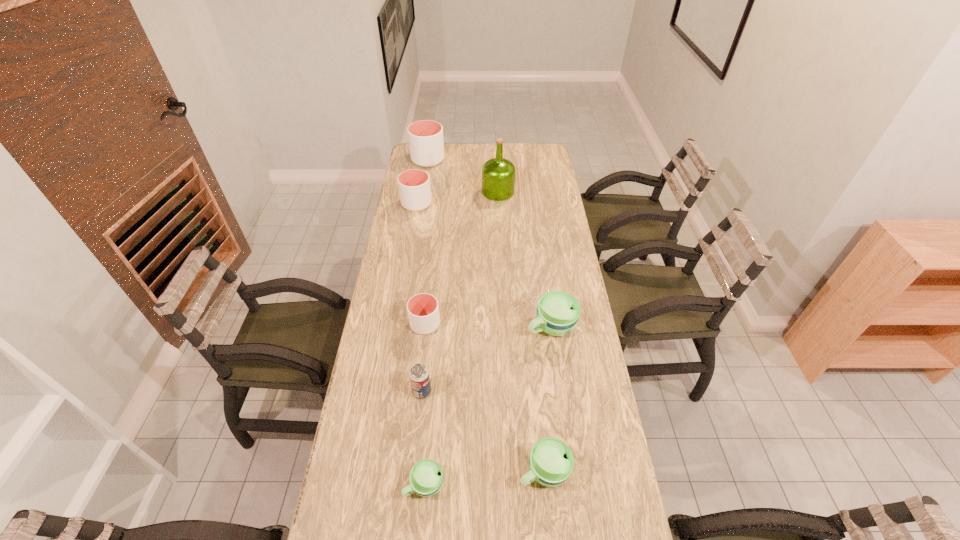
Locate an element on the screen. Image resolution: width=960 pixels, height=540 pixels. free spot located on the back of the fifth tallest cup is located at coordinates (531, 337).

You are a GUI agent. You are given a task and a screenshot of the screen. Output one action in this format:
    pyautogui.click(x=<x>, y=<y>)
    Task: Click on the free space located 0.350m on the back of the shortest cup
    Image resolution: width=960 pixels, height=540 pixels.
    Given the screenshot: What is the action you would take?
    pyautogui.click(x=435, y=361)

You are a GUI agent. You are given a task and a screenshot of the screen. Output one action in this format:
    pyautogui.click(x=<x>, y=<y>)
    Task: Click on the object located at the far edge
    This screenshot has height=540, width=960.
    Given the screenshot: What is the action you would take?
    pyautogui.click(x=426, y=144)

The width and height of the screenshot is (960, 540). Identify the location of object located in the far left corner section of the desktop. tap(426, 144).

Where is `vacant area at the left edge of the desktop`? The image size is (960, 540). vacant area at the left edge of the desktop is located at coordinates (369, 364).

In the image, there is a desktop. Where is `blank space at the right edge`? The height and width of the screenshot is (540, 960). blank space at the right edge is located at coordinates (567, 287).

Find the location of a particular element. The image size is (960, 540). vacant region at the far right corner of the desktop is located at coordinates (544, 143).

Image resolution: width=960 pixels, height=540 pixels. I want to click on free point between the green olive oil and the red beer can, so (460, 292).

This screenshot has width=960, height=540. What are the coordinates of `unoccupied area between the farthest blue cup and the red beer can` in the screenshot? It's located at (487, 359).

Find the location of a particular element. This screenshot has height=540, width=960. free area in between the second tallest cup and the biggest blue cup is located at coordinates (484, 265).